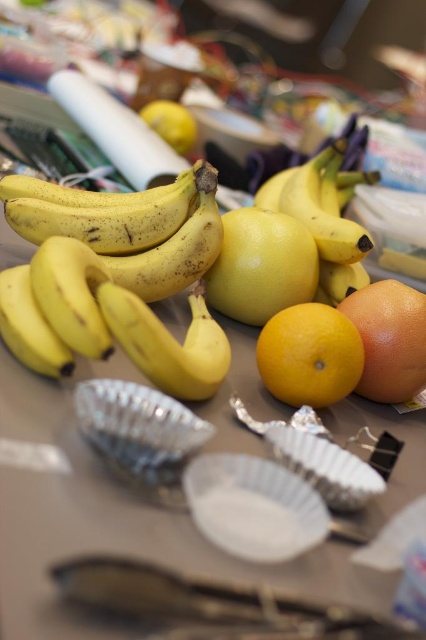
You are looking at the table with bananas and grapefruits. There are two points marked on the table surface. The first point is at coordinate point(284,230) and the second is at point(210,316). Which point is closer to you?

Point(210,316) is closer to you because it is in front of point(284,230).

What object is located at the coordinates point (261, 266)?

The point (261, 266) is on the yellow matte lemon at center.